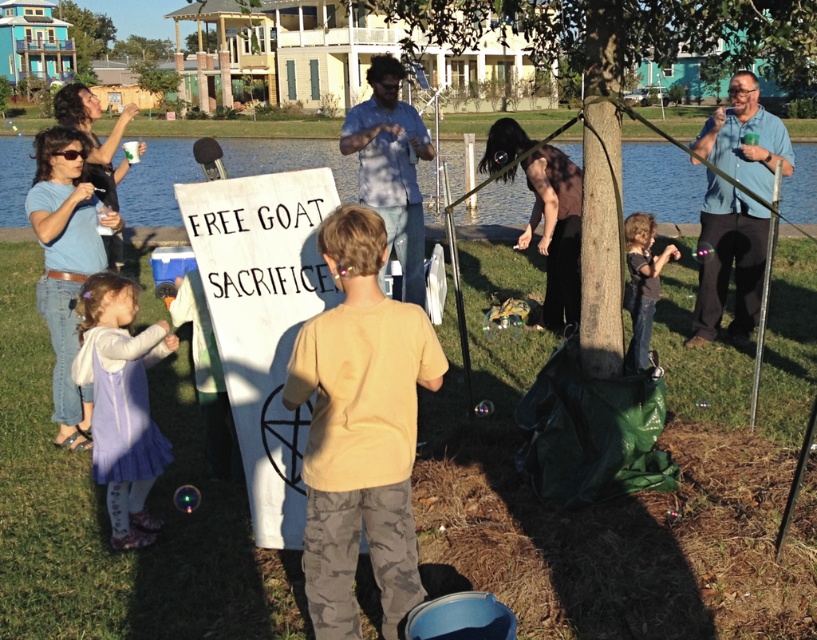
You are planning to set up a small tent between the brown bark tree at center and the blue water at lake left for a picnic. Given that the tent requires a minimum of 20 feet of space between the tree and the water to be safely set up, will there be enough space?

The brown bark tree at center and blue water at lake left are 24.43 feet apart from each other, which exceeds the minimum required 20 feet, so there is sufficient space to safely set up the tent between them.

From the picture: You are standing at the center of the scene. Which direction should you move to locate the purple fabric dress at lower left?

You should move to the lower left direction to locate the purple fabric dress at lower left as it is positioned at point (121, 403).

You are attending an outdoor event by the lake and notice the blue water at lake left and the purple fabric dress at lower left. Which object is positioned higher in the scene?

The blue water at lake left is positioned higher than the purple fabric dress at lower left.